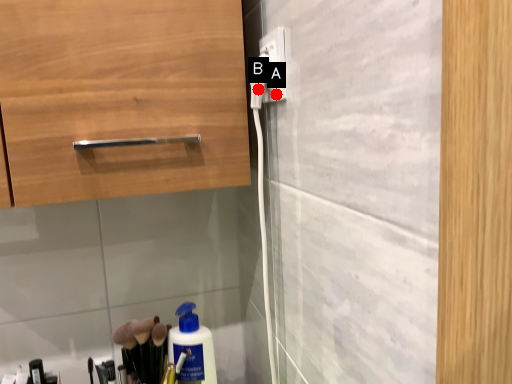
Question: Two points are circled on the image, labeled by A and B beside each circle. Which point appears farthest from the camera in this image?

Choices:
 (A) A is further
 (B) B is further

Answer: (B)